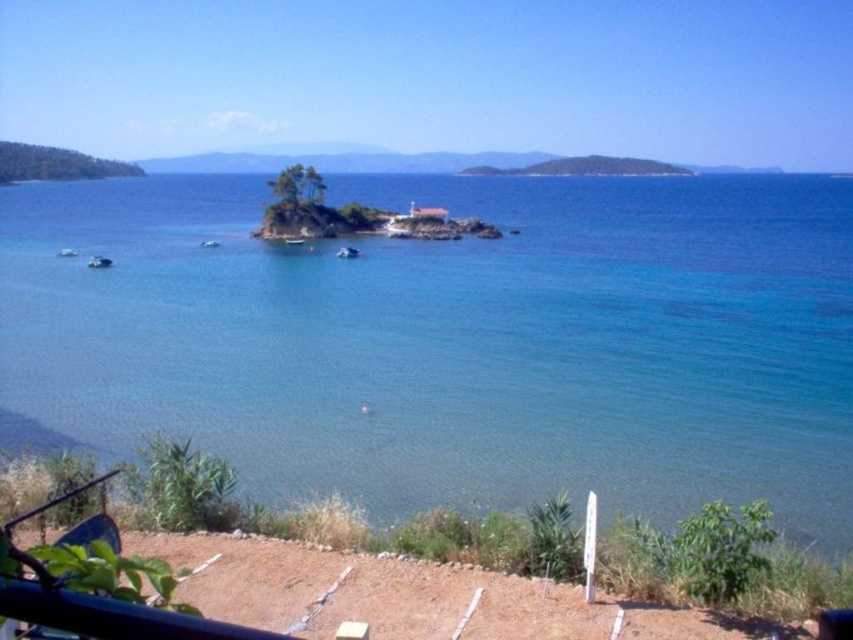
You are standing on the beach and see the clear blue water at center and the white glossy boat at center. Which object is closer to you?

The white glossy boat at center is closer to you because the clear blue water at center is positioned over it, indicating the boat is beneath the water surface.

You are standing on the beach looking out at the turquoise waters. There is a point marked at coordinates (347, 252). What object is located at that point?

The point at coordinates (347, 252) marks the white glossy boat at center.